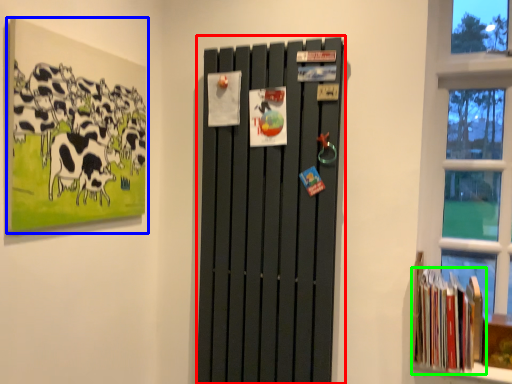
Question: Which object is the closest to the barn door (highlighted by a red box)? Choose among these: picture frame (highlighted by a blue box) or book (highlighted by a green box).

Choices:
 (A) picture frame
 (B) book

Answer: (B)